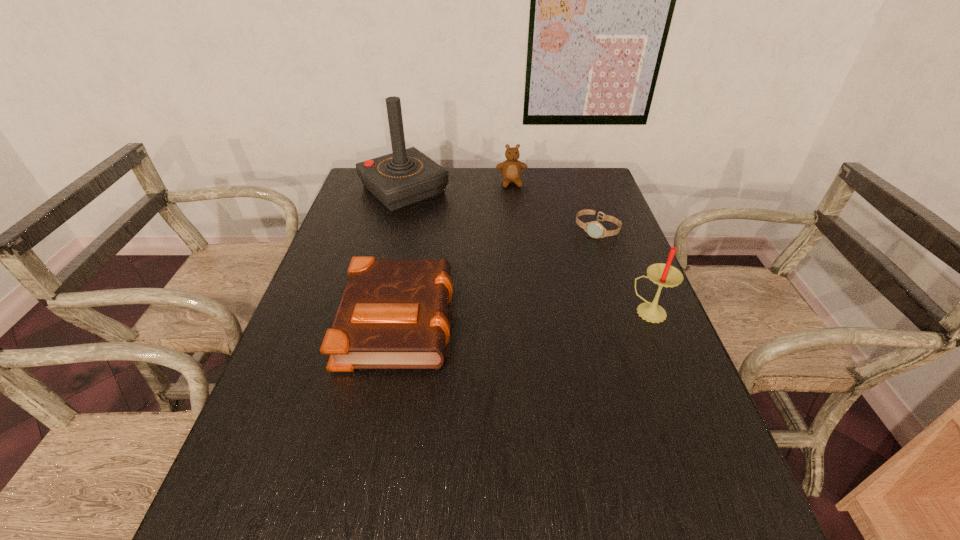
Image resolution: width=960 pixels, height=540 pixels. Find the location of `object that is the closest to the second tallest object`. object that is the closest to the second tallest object is located at coordinates (594, 229).

Select which object is the closest to the fourth shortest object. Please provide its 2D coordinates. Your answer should be formatted as a tuple, i.e. [(x, y)], where the tuple contains the x and y coordinates of a point satisfying the conditions above.

[(594, 229)]

The image size is (960, 540). In order to click on vacant space that satisfies the following two spatial constraints: 1. on the front side of the second shortest object; 2. on the spine side of the joystick in this screenshot , I will do `click(372, 318)`.

This screenshot has width=960, height=540. In order to click on free space that satisfies the following two spatial constraints: 1. on the front side of the third object from right to left; 2. on the right side of the candle in this screenshot , I will do `click(525, 313)`.